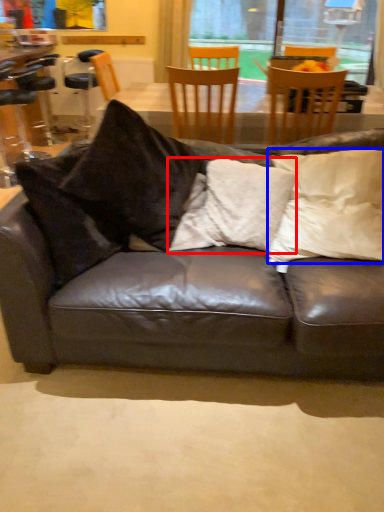
Question: Which object is closer to the camera taking this photo, pillow (highlighted by a red box) or pillow (highlighted by a blue box)?

Choices:
 (A) pillow
 (B) pillow

Answer: (B)